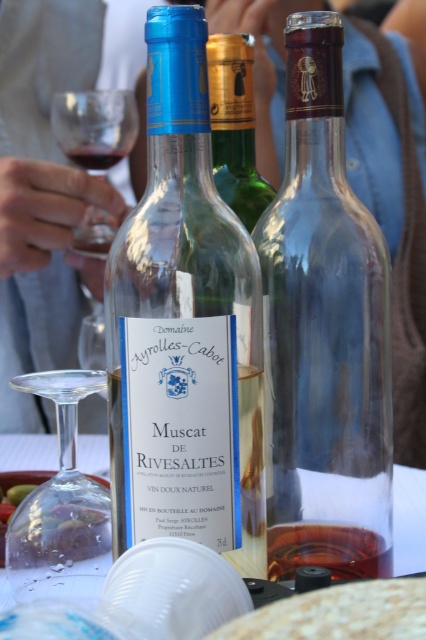
Can you confirm if white glass bottle at center is positioned to the right of transparent glass at lower left?

Correct, you'll find white glass bottle at center to the right of transparent glass at lower left.

Is white glass bottle at center closer to camera compared to transparent glass at lower left?

Yes, white glass bottle at center is closer to the viewer.

Measure the distance between point (233, 550) and camera.

Point (233, 550) is 9.28 inches from camera.

Where is `white glass bottle at center`? white glass bottle at center is located at coordinates (184, 328).

Can you confirm if white plastic cup at center is thinner than green glass bottle at center?

No, white plastic cup at center is not thinner than green glass bottle at center.

Does white plastic cup at center have a greater width compared to green glass bottle at center?

Yes.

At what (x,y) coordinates should I click in order to perform the action: click on white plastic cup at center. Please return your answer as a coordinate pair (x, y). The width and height of the screenshot is (426, 640). Looking at the image, I should click on (339, 614).

At what (x,y) coordinates should I click in order to perform the action: click on white plastic cup at center. Please return your answer as a coordinate pair (x, y). This screenshot has width=426, height=640. Looking at the image, I should click on (339, 614).

Is transparent glass bottle at center shorter than transparent glass at lower left?

No.

Can you confirm if transparent glass bottle at center is positioned above transparent glass at lower left?

Yes.

Locate an element on the screen. Image resolution: width=426 pixels, height=640 pixels. transparent glass bottle at center is located at coordinates (324, 333).